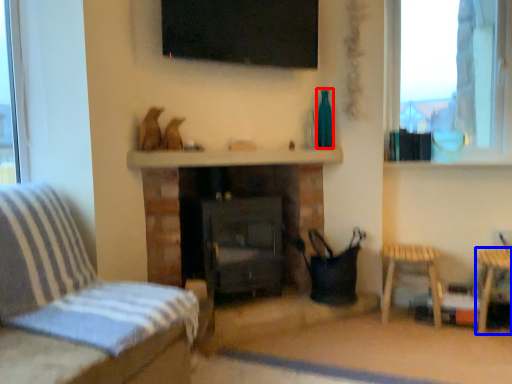
Question: Which object is closer to the camera taking this photo, bottle (highlighted by a red box) or side table (highlighted by a blue box)?

Choices:
 (A) bottle
 (B) side table

Answer: (B)